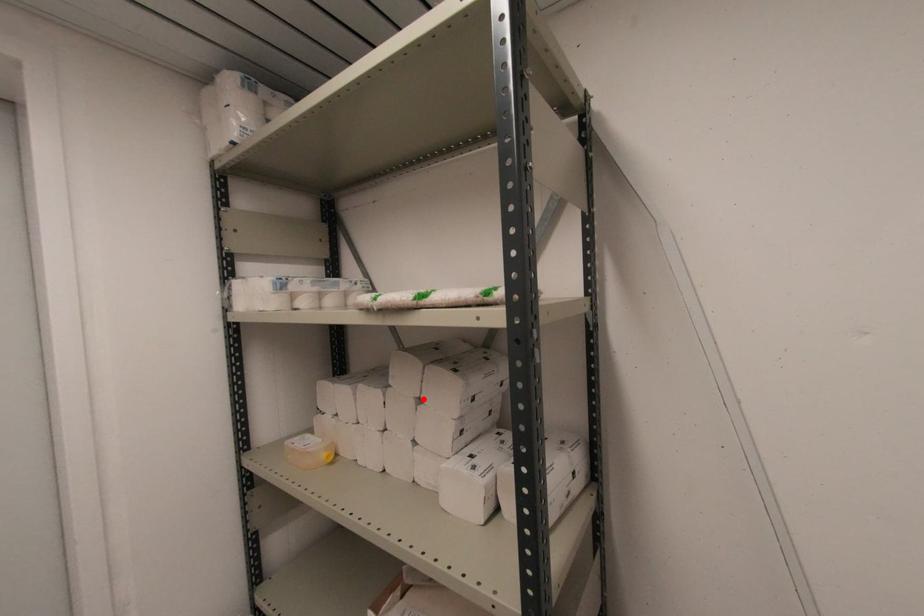
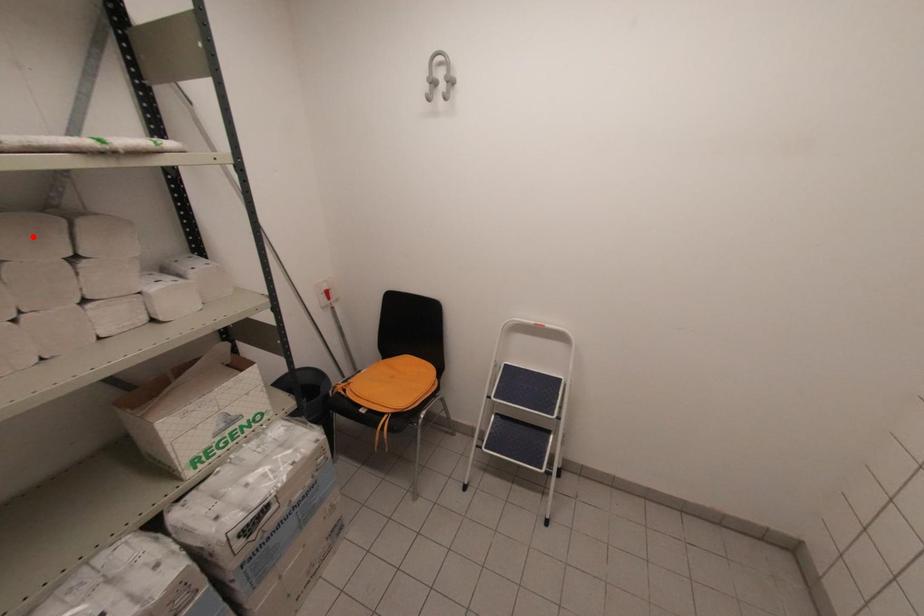
I am providing you with two images of the same scene from different viewpoints. A red point is marked on the first image and another point is marked on the second image. Does the point marked in image1 correspond to the same location as the one in image2?

No